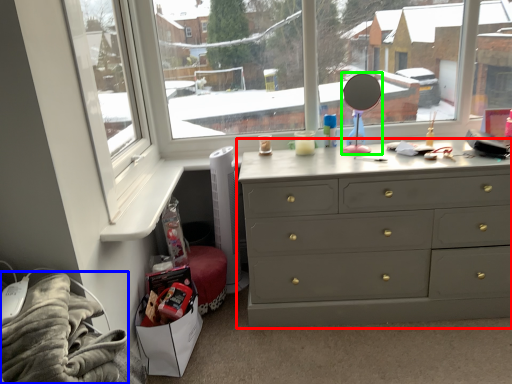
Question: Which object is positioned farthest from chest of drawers (highlighted by a red box)? Select from material (highlighted by a blue box) and mirror (highlighted by a green box).

Choices:
 (A) material
 (B) mirror

Answer: (A)